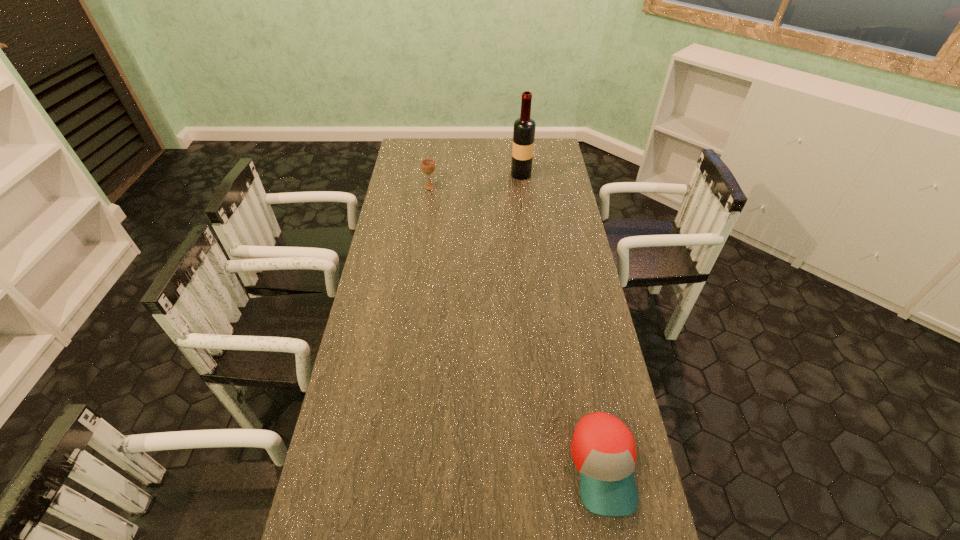
Where is `wine bottle`? The image size is (960, 540). wine bottle is located at coordinates (524, 127).

Image resolution: width=960 pixels, height=540 pixels. Identify the location of the farthest object. (x=524, y=127).

This screenshot has height=540, width=960. Identify the location of chalice. (428, 165).

At what (x,y) coordinates should I click in order to perform the action: click on the second shortest object. Please return your answer as a coordinate pair (x, y). Looking at the image, I should click on (428, 165).

I want to click on the shortest object, so click(x=603, y=449).

In order to click on the nearest object in this screenshot , I will do `click(603, 449)`.

At what (x,y) coordinates should I click in order to perform the action: click on free location located 0.060m on the right of the farthest object. Please return your answer as a coordinate pair (x, y). Looking at the image, I should click on (544, 174).

You are a GUI agent. You are given a task and a screenshot of the screen. Output one action in this format:
    pyautogui.click(x=<x>, y=<y>)
    Task: Click on the free location located on the front of the second farthest object
    
    Given the screenshot: What is the action you would take?
    pyautogui.click(x=428, y=202)

What are the coordinates of `object located at the left edge` in the screenshot? It's located at (428, 165).

Find the location of a particular element. wine bottle present at the right edge is located at coordinates (524, 127).